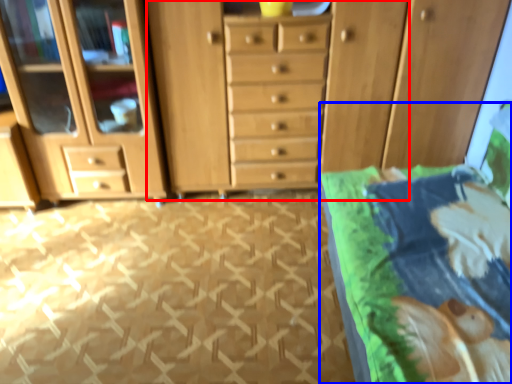
Question: Which of the following is the farthest to the observer, dresser (highlighted by a red box) or bed (highlighted by a blue box)?

Choices:
 (A) dresser
 (B) bed

Answer: (A)